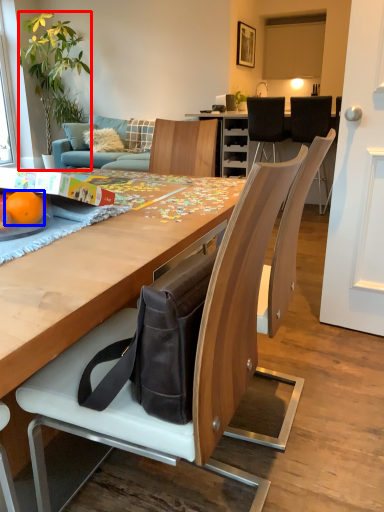
Question: Which object appears farthest to the camera in this image, houseplant (highlighted by a red box) or orange (highlighted by a blue box)?

Choices:
 (A) houseplant
 (B) orange

Answer: (A)